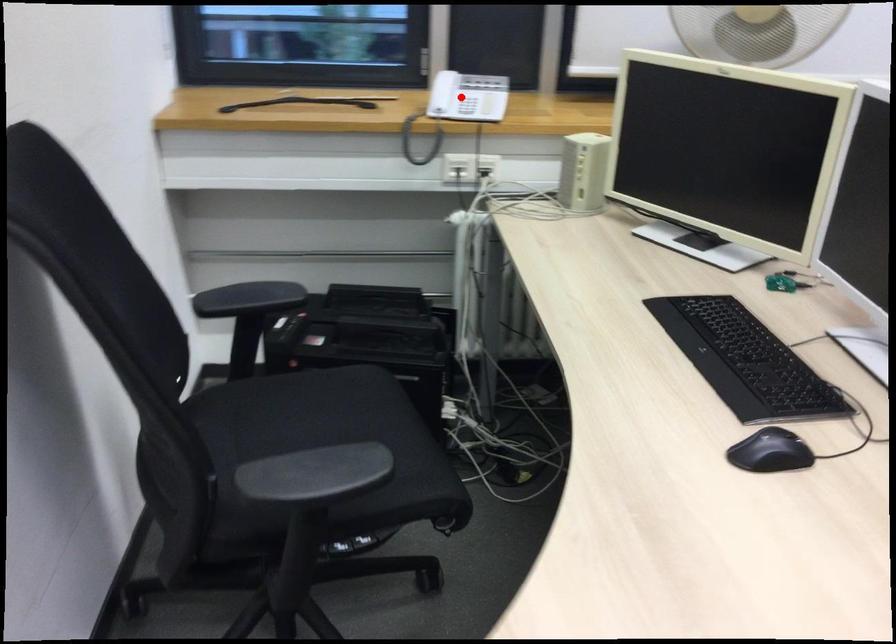
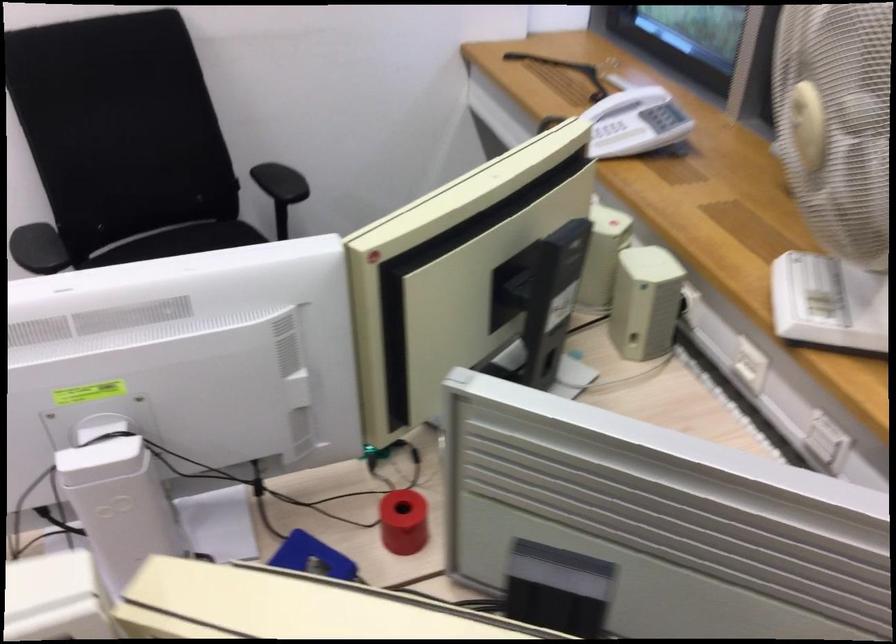
Question: I am providing you with two images of the same scene from different viewpoints. Image1 has a red point marked. In image2, the corresponding 3D location appears at what relative position? Reply with the corresponding letter.

Choices:
 (A) Closer
 (B) Farther

Answer: (A)